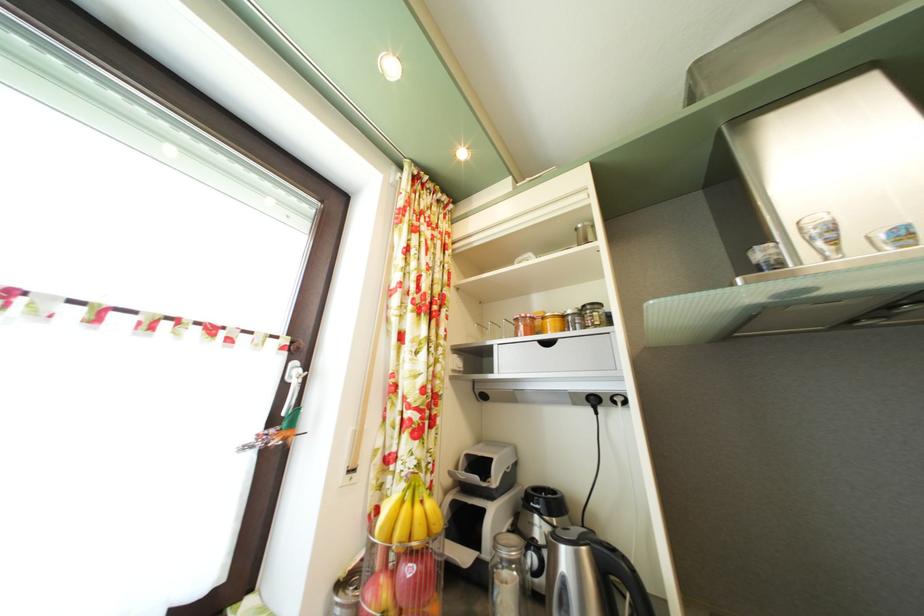
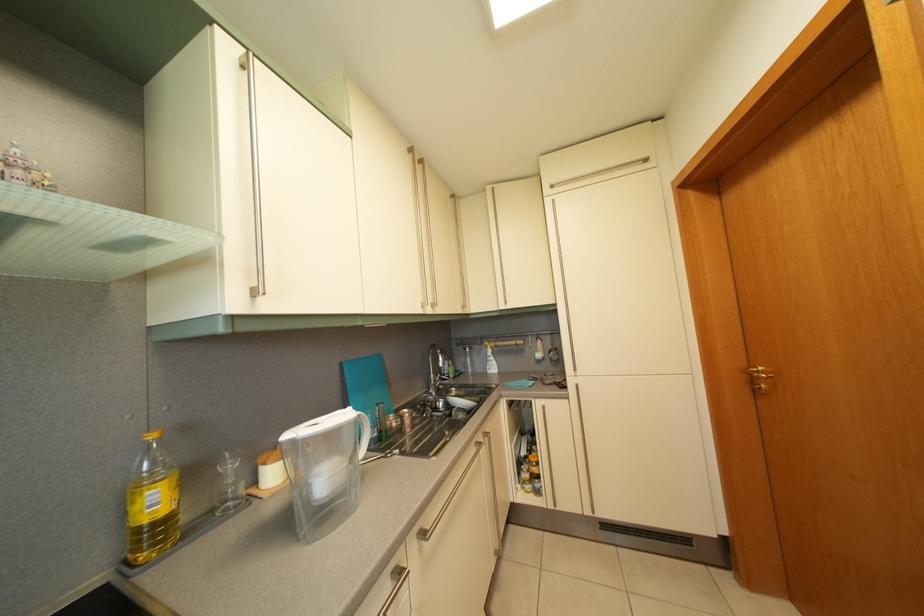
Question: The camera is either moving clockwise (left) or counter-clockwise (right) around the object. The first image is from the beginning of the video and the second image is from the end. Is the camera moving left or right when shooting the video?

Choices:
 (A) Left
 (B) Right

Answer: (A)